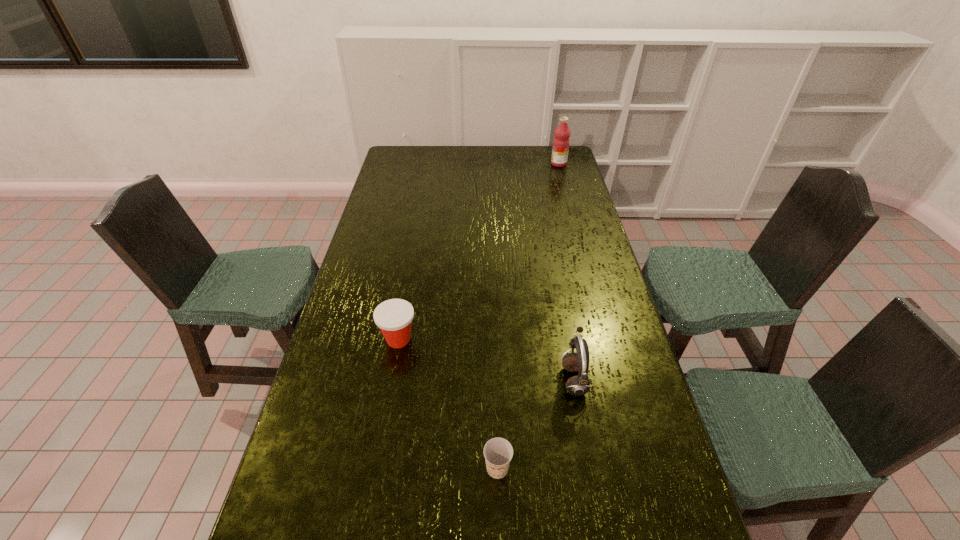
In the image, there is a desktop. At what (x,y) coordinates should I click in order to perform the action: click on free space at the far edge. Please return your answer as a coordinate pair (x, y). The width and height of the screenshot is (960, 540). Looking at the image, I should click on (513, 158).

At what (x,y) coordinates should I click in order to perform the action: click on vacant region at the left edge of the desktop. Please return your answer as a coordinate pair (x, y). The height and width of the screenshot is (540, 960). Looking at the image, I should click on (307, 400).

This screenshot has width=960, height=540. In the image, there is a desktop. Find the location of `free region at the right edge`. free region at the right edge is located at coordinates (607, 373).

Where is `vacant area that lies between the fruit juice and the farther Dixie cup`? The image size is (960, 540). vacant area that lies between the fruit juice and the farther Dixie cup is located at coordinates (479, 252).

Locate an element on the screen. The height and width of the screenshot is (540, 960). vacant region between the right Dixie cup and the second shortest object is located at coordinates (448, 404).

Image resolution: width=960 pixels, height=540 pixels. I want to click on vacant area between the nearest object and the earphone, so click(536, 423).

Locate an element on the screen. The image size is (960, 540). free space between the third object from left to right and the right Dixie cup is located at coordinates (536, 423).

At what (x,y) coordinates should I click in order to perform the action: click on free point between the right Dixie cup and the farthest object. Please return your answer as a coordinate pair (x, y). Image resolution: width=960 pixels, height=540 pixels. Looking at the image, I should click on (528, 316).

Locate an element on the screen. The image size is (960, 540). free space between the right Dixie cup and the leftmost object is located at coordinates (448, 404).

Locate an element on the screen. vacant space that's between the right Dixie cup and the farther Dixie cup is located at coordinates (448, 404).